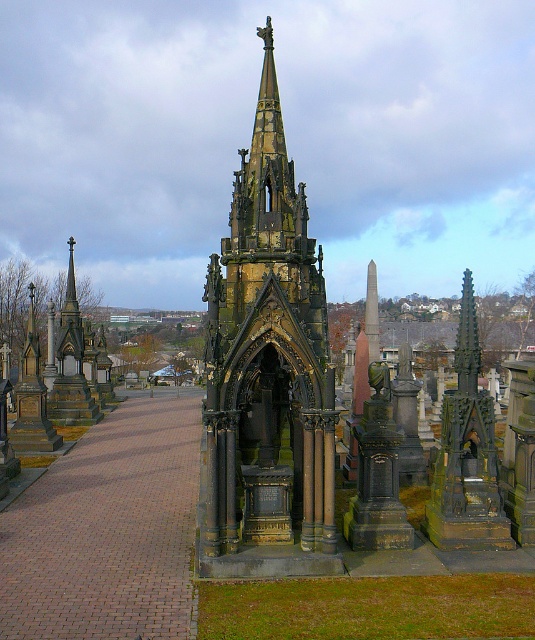
You are standing in front of the cemetery and want to take a photo of both the dark brown stone tower at center and the dark brown stone spire at left. Which object should you focus on first to ensure both are in frame?

You should focus on the dark brown stone spire at left first because the dark brown stone tower at center is below it, so adjusting the camera angle to include the spire at the top will naturally capture the tower below in the frame.

You are standing in a cemetery and see a point marked at coordinates (266, 374). What does this point indicate?

The point at (266, 374) marks the location of the dark brown stone tower at center.